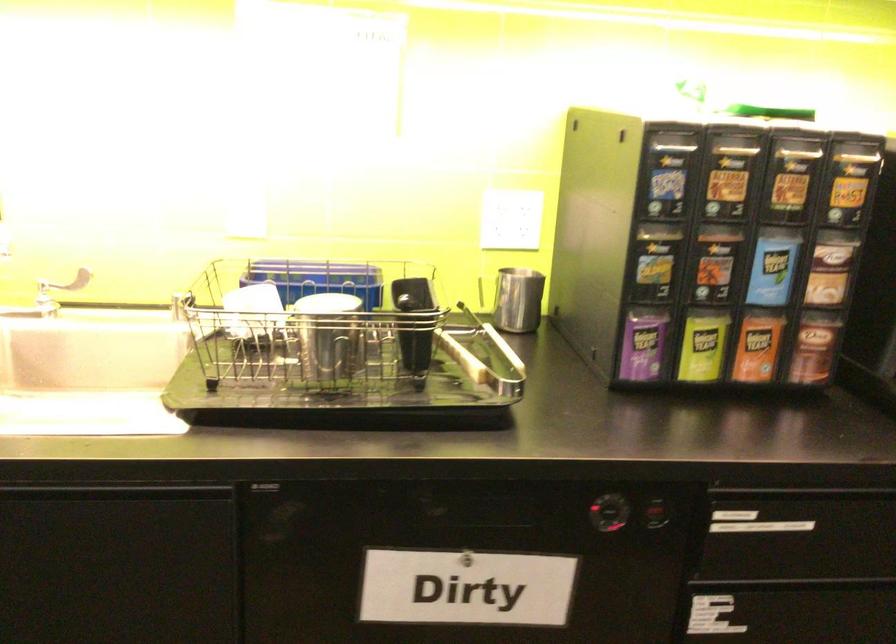
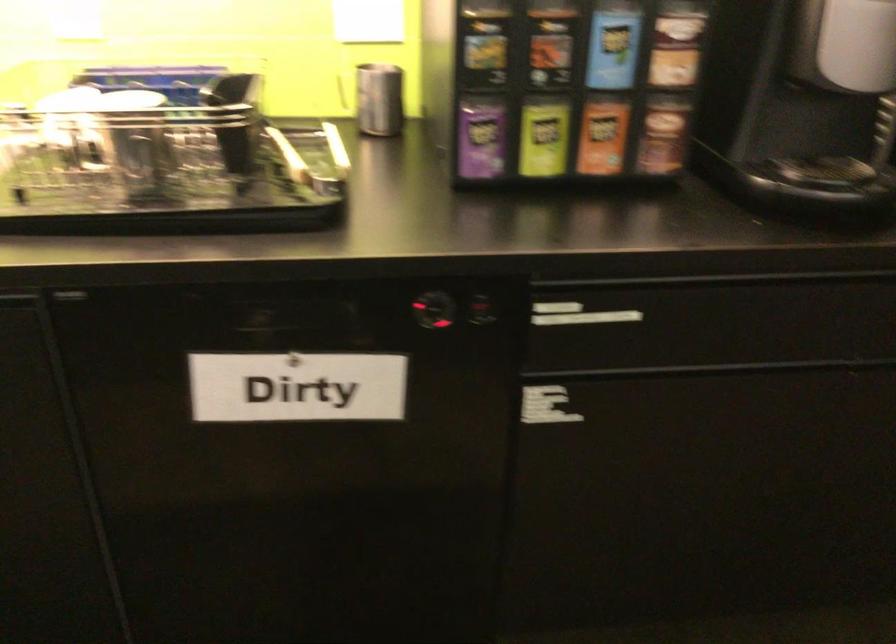
Where in the second image is the point corresponding to pixel 755 346 from the first image?

(602, 136)